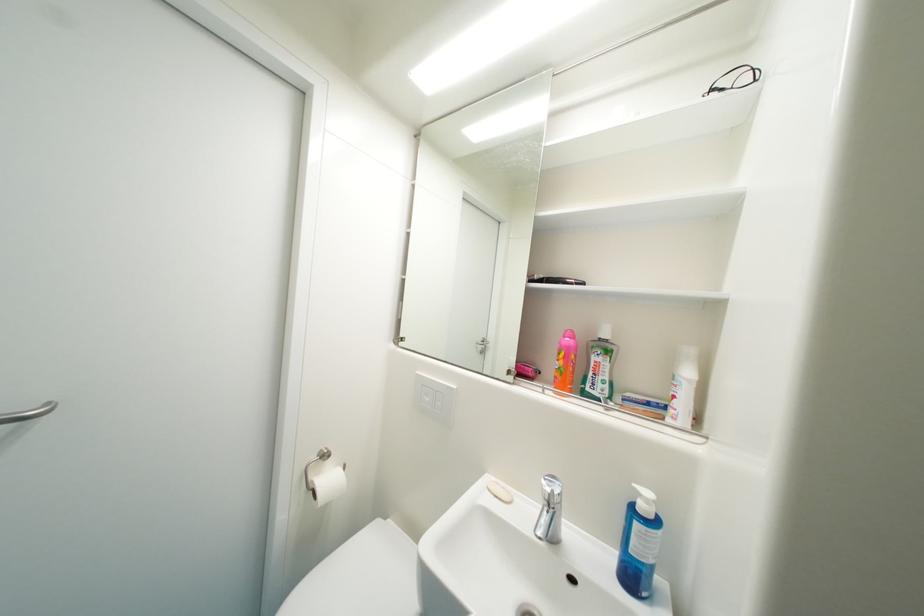
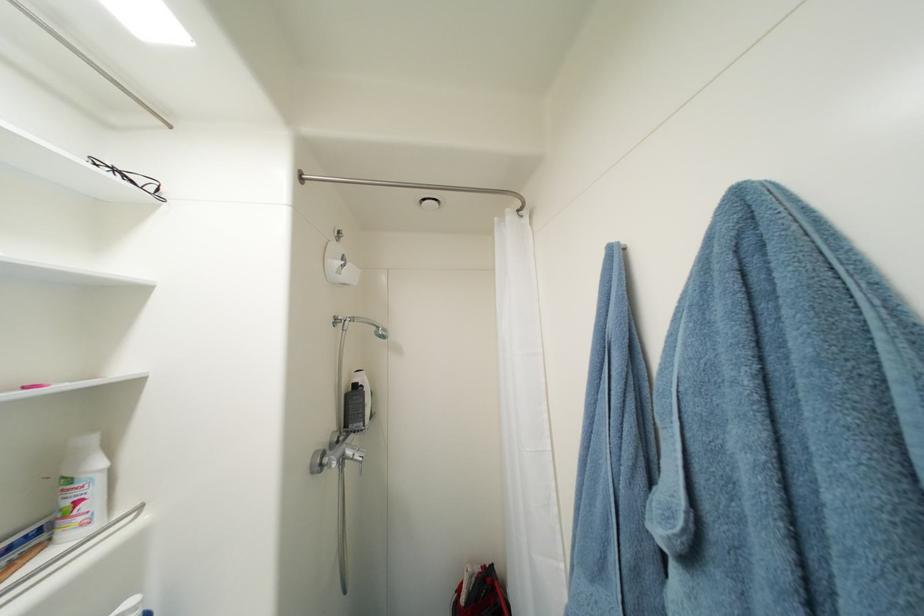
Find the pixel in the second image that matches (x=681, y=399) in the first image.

(84, 504)